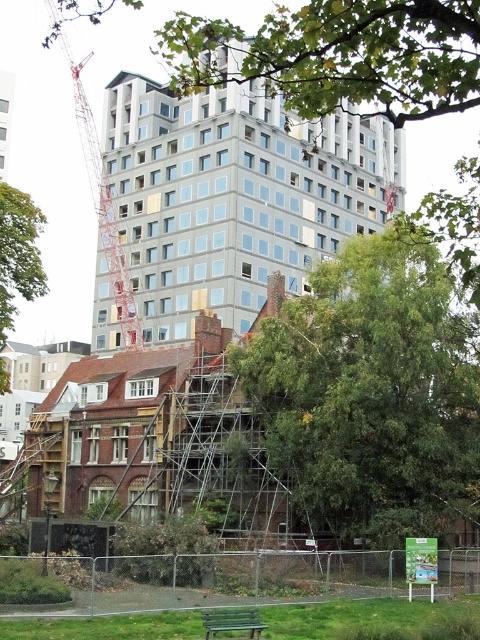
Question: Among these objects, which one is farthest from the camera?

Choices:
 (A) green leafy tree at left
 (B) green painted wood park bench at lower center
 (C) metallic red crane at upper left
 (D) green leafy tree at center

Answer: (A)

Question: Is green leafy tree at center closer to camera compared to metallic red crane at upper left?

Choices:
 (A) no
 (B) yes

Answer: (A)

Question: Which object is positioned closest to the metallic red crane at upper left?

Choices:
 (A) green painted wood park bench at lower center
 (B) green leafy tree at center

Answer: (B)

Question: Can you confirm if green leafy tree at center is wider than metallic red crane at upper left?

Choices:
 (A) no
 (B) yes

Answer: (A)

Question: Is metallic red crane at upper left closer to the viewer compared to green leafy tree at left?

Choices:
 (A) no
 (B) yes

Answer: (B)

Question: Which point appears closest to the camera in this image?

Choices:
 (A) (120, 269)
 (B) (410, 224)
 (C) (29, 272)
 (D) (240, 609)

Answer: (B)